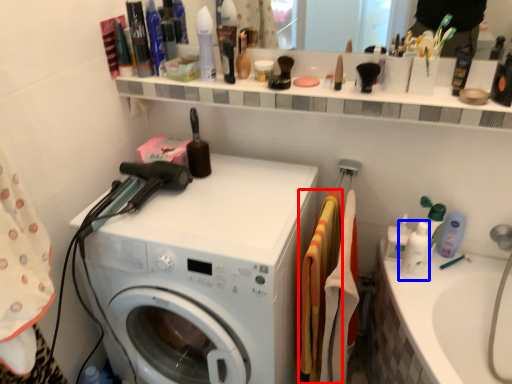
Question: Which object is further to the camera taking this photo, material (highlighted by a red box) or toiletry (highlighted by a blue box)?

Choices:
 (A) material
 (B) toiletry

Answer: (B)